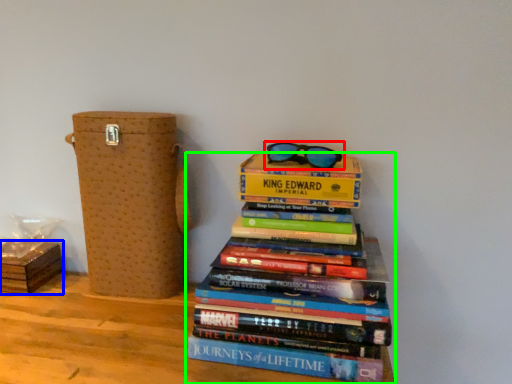
Question: Based on their relative distances, which object is farther from glasses (highlighted by a red box)? Choose from cardboard box (highlighted by a blue box) and book (highlighted by a green box).

Choices:
 (A) cardboard box
 (B) book

Answer: (A)